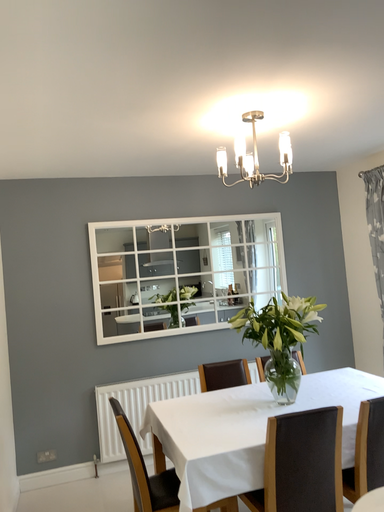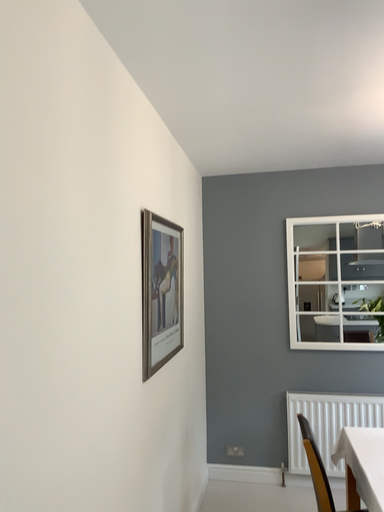
Question: How did the camera likely rotate when shooting the video?

Choices:
 (A) rotated left
 (B) rotated right

Answer: (A)